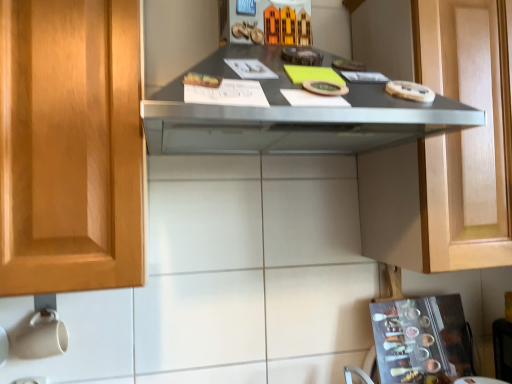
Where is `metallic silver spice rack at lower right`? This screenshot has height=384, width=512. metallic silver spice rack at lower right is located at coordinates (422, 340).

This screenshot has width=512, height=384. In order to click on matte gray countertop at center in this screenshot , I will do `click(291, 116)`.

Is metallic silver spice rack at lower right in contact with matte gray countertop at center?

metallic silver spice rack at lower right is not next to matte gray countertop at center, and they're not touching.

Can you confirm if metallic silver spice rack at lower right is taller than matte gray countertop at center?

In fact, metallic silver spice rack at lower right may be shorter than matte gray countertop at center.

From the picture: Based on their positions, is metallic silver spice rack at lower right located to the left or right of matte gray countertop at center?

From the image, it's evident that metallic silver spice rack at lower right is to the right of matte gray countertop at center.

Identify the location of countertop above the metallic silver spice rack at lower right (from a real-world perspective). (291, 116).

Does matte gray countertop at center contain metallic silver spice rack at lower right?

No, metallic silver spice rack at lower right is located outside of matte gray countertop at center.

Which object is positioned more to the left, matte gray countertop at center or metallic silver spice rack at lower right?

Answer: matte gray countertop at center is more to the left.

Can you confirm if matte gray countertop at center is smaller than metallic silver spice rack at lower right?

Incorrect, matte gray countertop at center is not smaller in size than metallic silver spice rack at lower right.

Which object is wider, matte gray countertop at center or metallic silver spice rack at lower right?

matte gray countertop at center.

Is metallic silver spice rack at lower right turned away from matte wood cabinet at upper right?

No, metallic silver spice rack at lower right is not facing away from matte wood cabinet at upper right.

Identify the location of cabinetry above the metallic silver spice rack at lower right (from the image's perspective). This screenshot has height=384, width=512. (448, 151).

Which object is more forward, metallic silver spice rack at lower right or matte wood cabinet at upper right?

Positioned in front is matte wood cabinet at upper right.

Which object is thinner, metallic silver spice rack at lower right or matte wood cabinet at upper right?

metallic silver spice rack at lower right is thinner.

From the image's perspective, is matte wood cabinet at upper right above or below matte gray countertop at center?

From the image's perspective, matte wood cabinet at upper right appears below matte gray countertop at center.

What's the angular difference between matte wood cabinet at upper right and matte gray countertop at center's facing directions?

matte wood cabinet at upper right and matte gray countertop at center are facing 0.000272 degrees away from each other.

Considering the positions of points (361, 164) and (298, 145), is point (361, 164) closer to camera compared to point (298, 145)?

No.

Measure the distance between matte wood cabinet at upper right and matte gray countertop at center.

9.47 inches.

Can you tell me how much matte wood cabinet at upper right and metallic silver spice rack at lower right differ in facing direction?

The angular difference between matte wood cabinet at upper right and metallic silver spice rack at lower right is 4.32 degrees.

Is matte wood cabinet at upper right aimed at metallic silver spice rack at lower right?

No, matte wood cabinet at upper right is not turned towards metallic silver spice rack at lower right.

Can you confirm if matte wood cabinet at upper right is smaller than metallic silver spice rack at lower right?

Incorrect, matte wood cabinet at upper right is not smaller in size than metallic silver spice rack at lower right.

Is matte wood cabinet at upper right wider or thinner than metallic silver spice rack at lower right?

matte wood cabinet at upper right is wider than metallic silver spice rack at lower right.

Does matte gray countertop at center turn towards matte wood cabinet at upper right?

No, matte gray countertop at center is not facing towards matte wood cabinet at upper right.

From their relative heights in the image, would you say matte gray countertop at center is taller or shorter than matte wood cabinet at upper right?

Considering their sizes, matte gray countertop at center has less height than matte wood cabinet at upper right.

Between matte gray countertop at center and matte wood cabinet at upper right, which one has larger size?

matte wood cabinet at upper right is bigger.

Would you say matte gray countertop at center is a long distance from matte wood cabinet at upper right?

No, matte gray countertop at center is not far away from matte wood cabinet at upper right.

You are a GUI agent. You are given a task and a screenshot of the screen. Output one action in this format:
    pyautogui.click(x=<x>, y=<y>)
    Task: Click on the countertop located in front of the metallic silver spice rack at lower right
    This screenshot has width=512, height=384.
    Given the screenshot: What is the action you would take?
    pyautogui.click(x=291, y=116)

The image size is (512, 384). In the image, there is a metallic silver spice rack at lower right. What are the coordinates of `countertop above it (from the image's perspective)` in the screenshot? It's located at (291, 116).

Looking at the image, which one is located further to metallic silver spice rack at lower right, matte gray countertop at center or matte wood cabinet at upper right?

The object further to metallic silver spice rack at lower right is matte gray countertop at center.

From the picture: Which object lies further to the anchor point matte gray countertop at center, metallic silver spice rack at lower right or matte wood cabinet at upper right?

metallic silver spice rack at lower right is positioned further to the anchor matte gray countertop at center.

Estimate the real-world distances between objects in this image. Which object is closer to matte gray countertop at center, matte wood cabinet at upper right or metallic silver spice rack at lower right?

matte wood cabinet at upper right.

Considering their positions, is matte gray countertop at center positioned further to matte wood cabinet at upper right than metallic silver spice rack at lower right?

metallic silver spice rack at lower right is positioned further to the anchor matte wood cabinet at upper right.

Considering their positions, is metallic silver spice rack at lower right positioned closer to matte wood cabinet at upper right than matte gray countertop at center?

Among the two, matte gray countertop at center is located nearer to matte wood cabinet at upper right.

Based on their spatial positions, is matte wood cabinet at upper right or matte gray countertop at center closer to metallic silver spice rack at lower right?

Among the two, matte wood cabinet at upper right is located nearer to metallic silver spice rack at lower right.

What are the coordinates of `cabinetry between matte gray countertop at center and metallic silver spice rack at lower right in the up-down direction` in the screenshot? It's located at (448, 151).